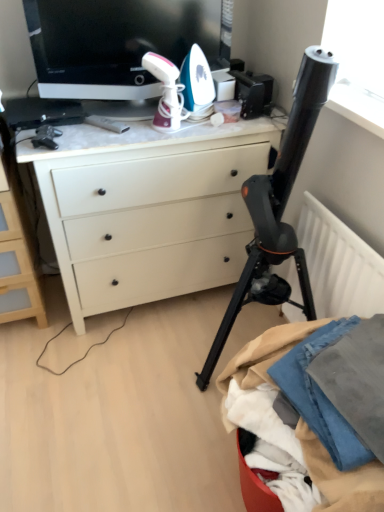
The height and width of the screenshot is (512, 384). What are the coordinates of `free space to the right of white matte chest of drawers at left` in the screenshot? It's located at (85, 328).